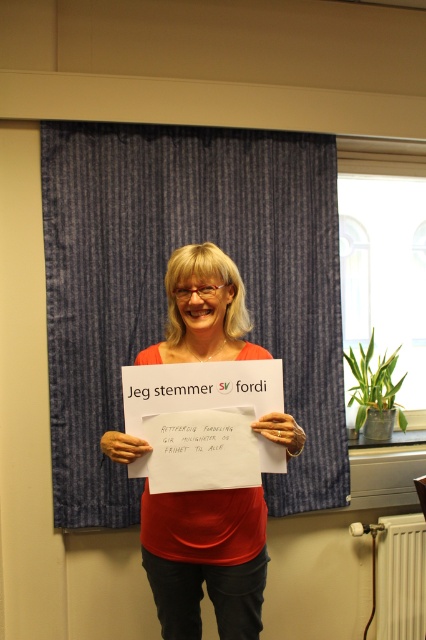
The width and height of the screenshot is (426, 640). Describe the element at coordinates (164, 291) in the screenshot. I see `blue striped curtain at upper center` at that location.

Between blue striped curtain at upper center and matte paper sign at center, which one appears on the left side from the viewer's perspective?

Positioned to the left is blue striped curtain at upper center.

The width and height of the screenshot is (426, 640). I want to click on blue striped curtain at upper center, so click(x=164, y=291).